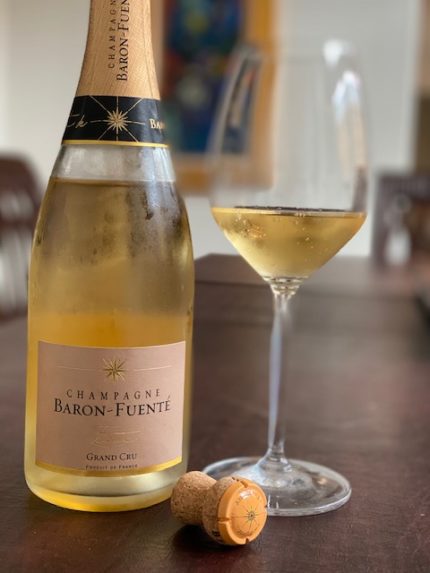
Locate an element on the screen. painting on wall in background is located at coordinates (201, 96).